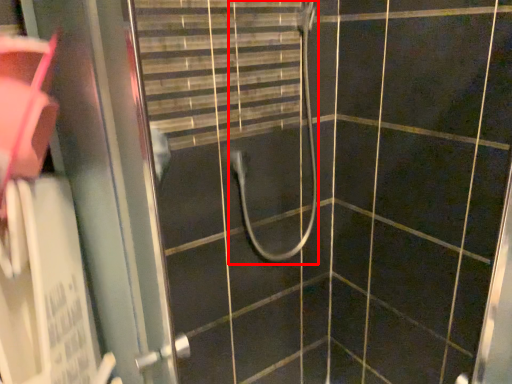
Question: From the image's perspective, what is the correct spatial positioning of shower (annotated by the red box) in reference to screen door?

Choices:
 (A) above
 (B) below

Answer: (A)